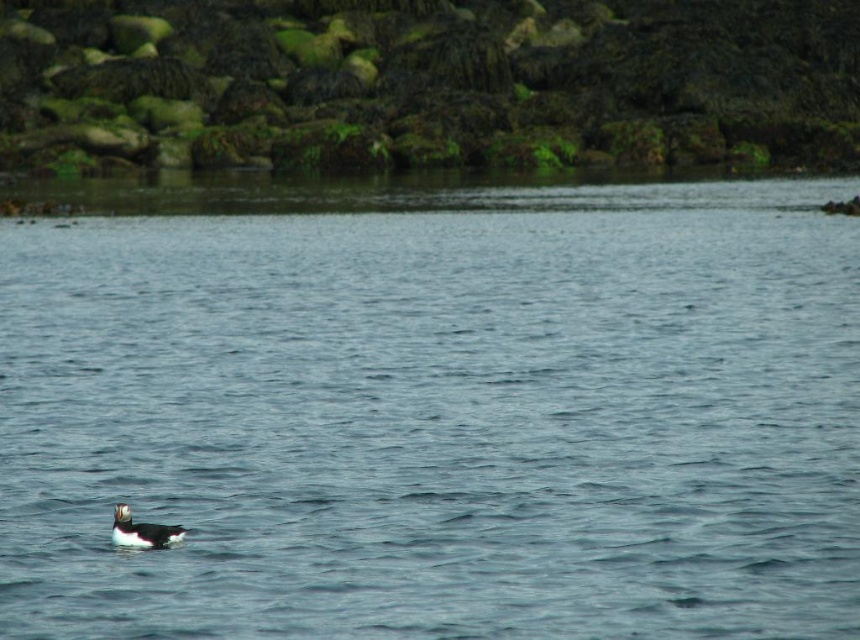
You are standing on the shore looking at the blue water at center and the white fluffy duck at lower left. Which object is higher in the image?

The blue water at center is higher than the white fluffy duck at lower left.

You are standing at the edge of the water in the coastal scene. There is a point marked at coordinates point (x=445, y=490). Can you reach this point without getting wet?

The point (x=445, y=490) is 12.09 meters away from the viewer, so yes, you can reach it without getting wet since it is far enough from the water edge.

You are an observer standing at the edge of the scene. You notice the blue water at center and the white fluffy duck at lower left. Which object appears taller in the image?

The blue water at center appears taller than the white fluffy duck at lower left in the image.